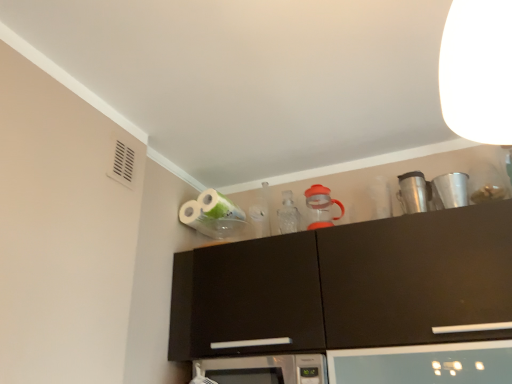
Question: From a real-world perspective, is white glossy toilet paper at upper center physically below orange plastic pitcher at upper center, which is the first appliance in left-to-right order?

Choices:
 (A) no
 (B) yes

Answer: (A)

Question: Can you confirm if white glossy toilet paper at upper center is positioned to the right of orange plastic pitcher at upper center, which is the first appliance in left-to-right order?

Choices:
 (A) yes
 (B) no

Answer: (B)

Question: From the image's perspective, is white glossy toilet paper at upper center located beneath orange plastic pitcher at upper center, the 3th appliance viewed from the right?

Choices:
 (A) yes
 (B) no

Answer: (A)

Question: Is white glossy toilet paper at upper center taller than orange plastic pitcher at upper center, the 3th appliance viewed from the right?

Choices:
 (A) yes
 (B) no

Answer: (B)

Question: Are white glossy toilet paper at upper center and orange plastic pitcher at upper center, which is the first appliance in left-to-right order, far apart?

Choices:
 (A) yes
 (B) no

Answer: (B)

Question: Does white glossy toilet paper at upper center have a greater width compared to orange plastic pitcher at upper center, which is the first appliance in left-to-right order?

Choices:
 (A) no
 (B) yes

Answer: (B)

Question: Is silver metallic microwave at center smaller than white glossy toilet paper at upper center?

Choices:
 (A) no
 (B) yes

Answer: (A)

Question: Is white glossy toilet paper at upper center located within silver metallic microwave at center?

Choices:
 (A) yes
 (B) no

Answer: (B)

Question: From a real-world perspective, does silver metallic microwave at center sit lower than white glossy toilet paper at upper center?

Choices:
 (A) no
 (B) yes

Answer: (B)

Question: Considering the relative sizes of silver metallic microwave at center and white glossy toilet paper at upper center in the image provided, is silver metallic microwave at center thinner than white glossy toilet paper at upper center?

Choices:
 (A) no
 (B) yes

Answer: (A)

Question: Can you confirm if silver metallic microwave at center is positioned to the left of white glossy toilet paper at upper center?

Choices:
 (A) yes
 (B) no

Answer: (B)

Question: From the image's perspective, would you say silver metallic microwave at center is shown under white glossy toilet paper at upper center?

Choices:
 (A) yes
 (B) no

Answer: (A)

Question: From the image's perspective, is orange plastic pitcher at upper center, the 3th appliance viewed from the right, under shiny metallic coffee cup at upper right, the 2th appliance in the left-to-right sequence?

Choices:
 (A) yes
 (B) no

Answer: (A)